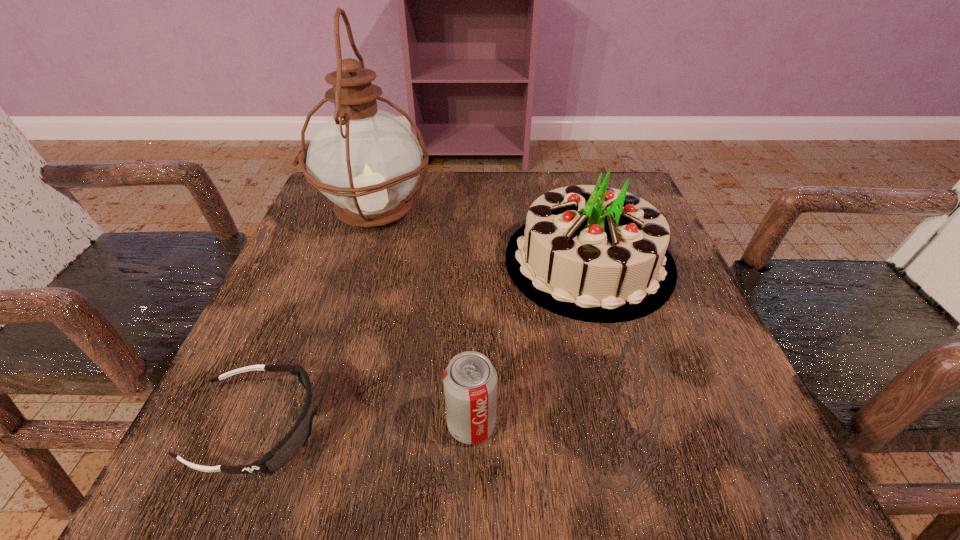
Image resolution: width=960 pixels, height=540 pixels. Identify the location of the tallest object. (365, 160).

Image resolution: width=960 pixels, height=540 pixels. Find the location of `the third shortest object`. the third shortest object is located at coordinates (592, 253).

Find the location of `birthday cake`. birthday cake is located at coordinates tap(592, 253).

Locate an element on the screen. the third object from left to right is located at coordinates (470, 380).

Where is `the third tallest object`? This screenshot has height=540, width=960. the third tallest object is located at coordinates (470, 380).

Where is `goggles`? This screenshot has width=960, height=540. goggles is located at coordinates (296, 438).

At what (x,y) coordinates should I click in order to perform the action: click on free space located on the right of the oil lamp. Please return your answer as a coordinate pair (x, y). The image size is (960, 540). Looking at the image, I should click on (464, 212).

I want to click on free space located on the front of the birthday cake, so click(x=646, y=464).

I want to click on vacant area situated on the back of the soda can, so click(474, 255).

I want to click on vacant space located on the front and sides of the shortest object, so click(x=607, y=427).